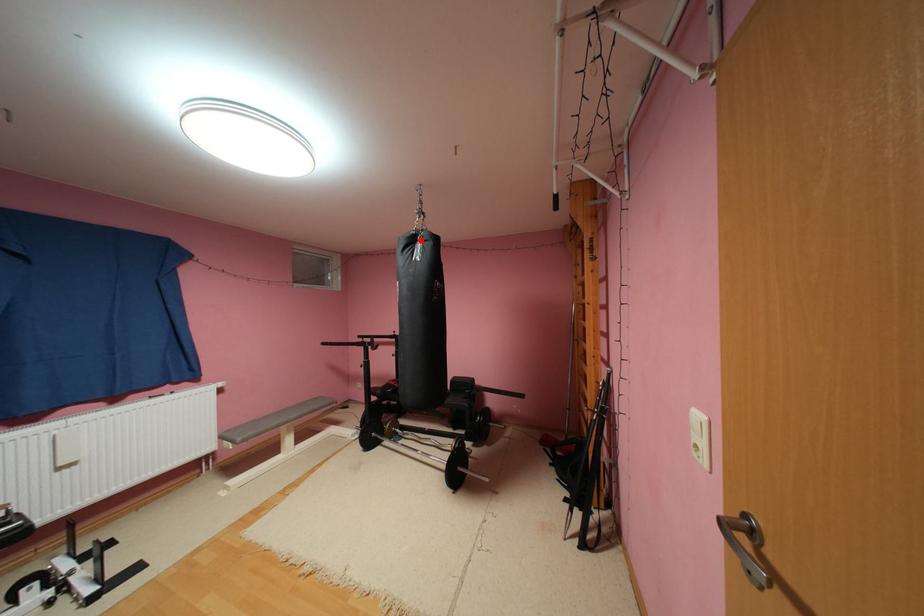
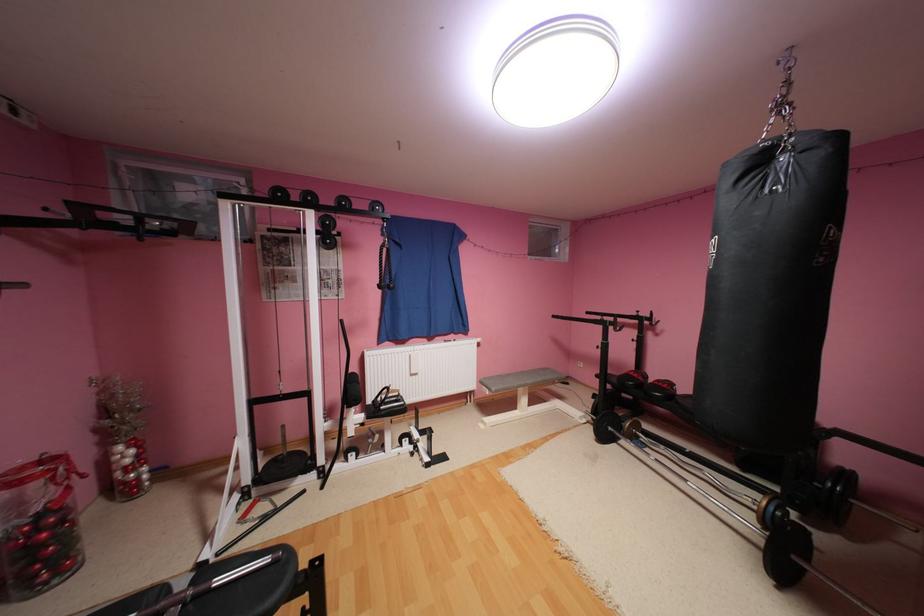
Locate, in the second image, the point that corresponds to the highlighted location in the first image.

(769, 161)